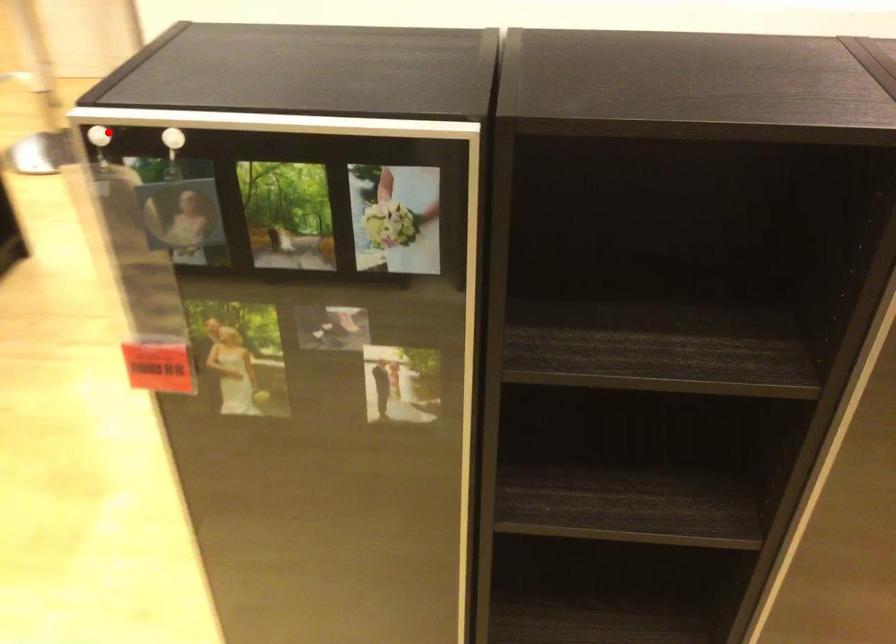
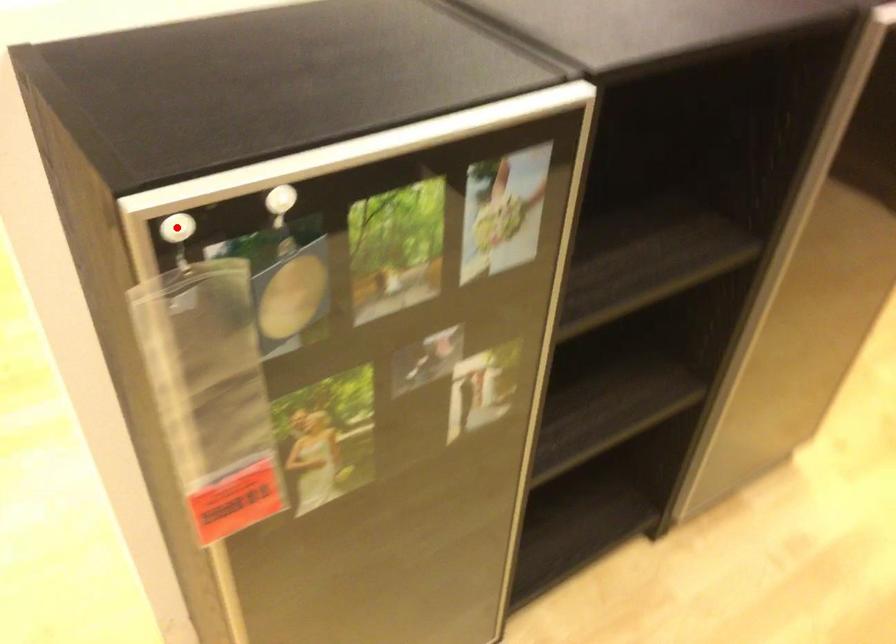
I am providing you with two images of the same scene from different viewpoints. A red point is marked on the first image and another point is marked on the second image. Is the marked point in image1 the same physical position as the marked point in image2?

Yes